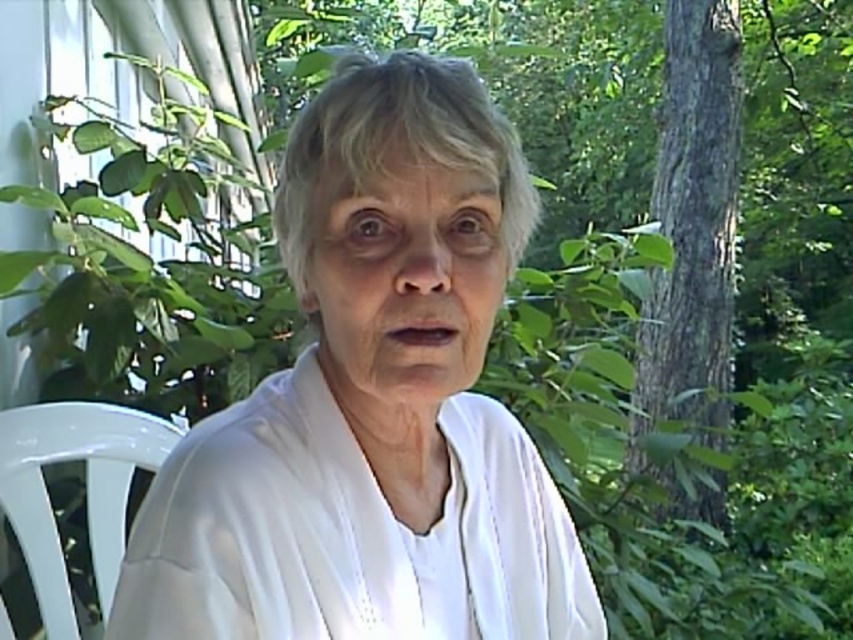
You are a photographer taking a portrait of the elderly person in the image. You notice a white matte shirt at center located at point (373, 403). To ensure the shirt is in focus, you need to know if it is closer to the camera than the tree trunk on the right. Is the white matte shirt at center closer to the camera than the tree trunk on the right?

The white matte shirt at center is located at point (373, 403). Since the tree trunk is on the right side of the frame, the shirt is closer to the camera than the tree trunk on the right.